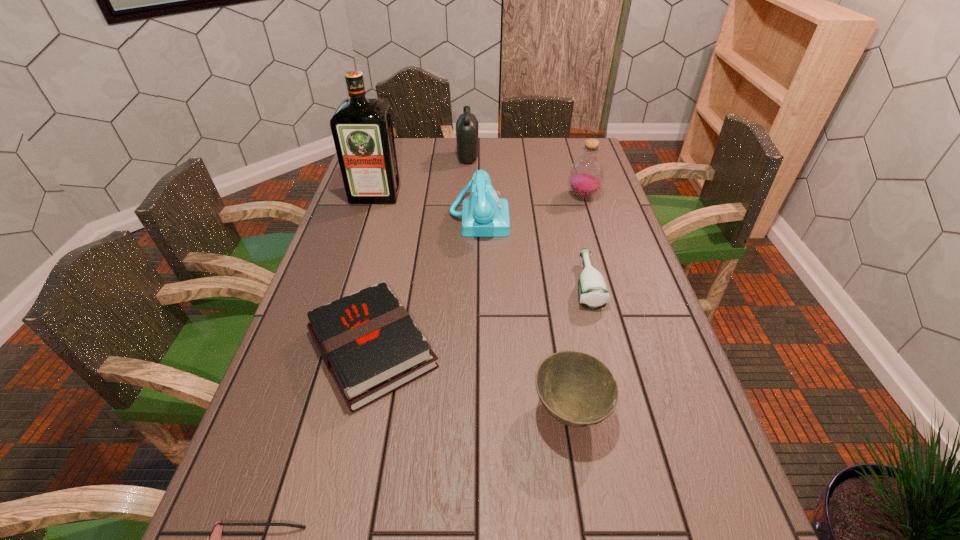
Identify the location of the tallest object. (362, 129).

Locate an element on the screen. the leftmost bottle is located at coordinates (467, 125).

Locate an element on the screen. The width and height of the screenshot is (960, 540). the farthest bottle is located at coordinates (467, 125).

Where is `the second farthest bottle`? This screenshot has height=540, width=960. the second farthest bottle is located at coordinates (586, 175).

Where is `the fifth shortest object`? This screenshot has height=540, width=960. the fifth shortest object is located at coordinates (484, 214).

At what (x,y) coordinates should I click in order to perform the action: click on bowl. Please return your answer as a coordinate pair (x, y). The height and width of the screenshot is (540, 960). Looking at the image, I should click on (577, 389).

The width and height of the screenshot is (960, 540). In order to click on the nearest bottle in this screenshot , I will do `click(593, 294)`.

What are the coordinates of `hardback book` in the screenshot? It's located at (369, 343).

I want to click on free spot located 0.280m on the front label of the liquor, so click(x=355, y=258).

Where is `free space located on the right of the farthest bottle`? free space located on the right of the farthest bottle is located at coordinates (541, 158).